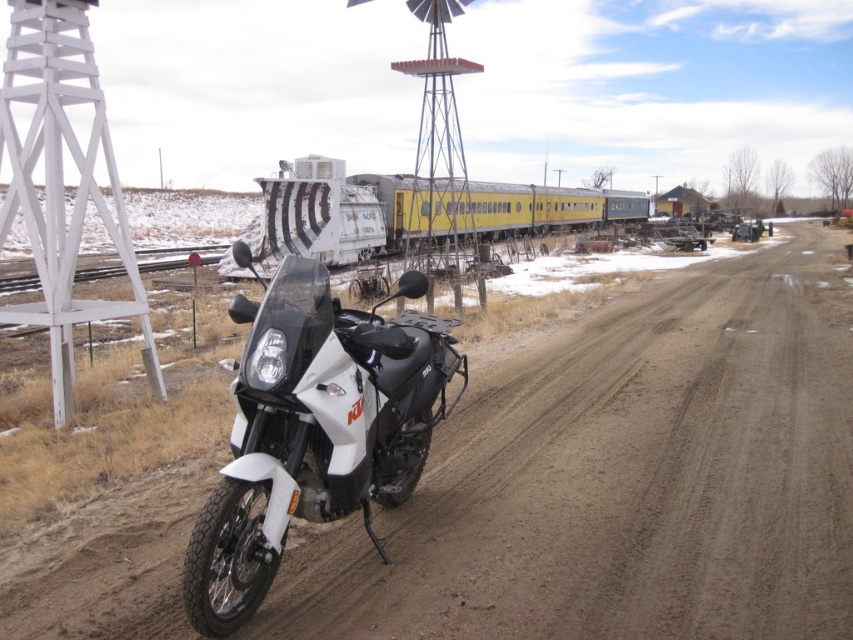
Question: Which point appears closest to the camera in this image?

Choices:
 (A) (323, 291)
 (B) (73, 358)
 (C) (393, 236)

Answer: (A)

Question: Which point is farther to the camera?

Choices:
 (A) (103, 128)
 (B) (669, 547)
 (C) (460, 374)
 (D) (268, 204)

Answer: (D)

Question: Is dirt track at center thinner than yellow matte train car at center?

Choices:
 (A) no
 (B) yes

Answer: (B)

Question: Among these points, which one is farthest from the camera?

Choices:
 (A) (259, 365)
 (B) (271, 204)
 (C) (53, 243)

Answer: (B)

Question: Does dirt track at center have a larger size compared to yellow matte train car at center?

Choices:
 (A) no
 (B) yes

Answer: (A)

Question: From the image, what is the correct spatial relationship of dirt track at center in relation to white painted wood windmill at left?

Choices:
 (A) below
 (B) above

Answer: (A)